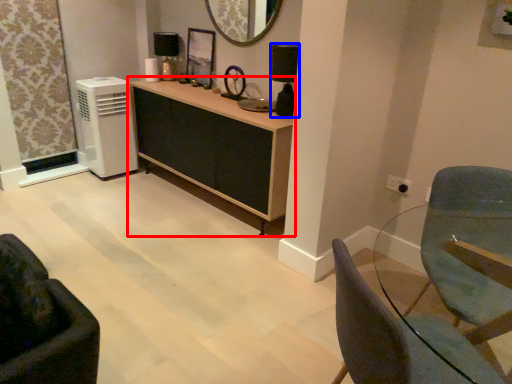
Question: Among these objects, which one is farthest to the camera, cabinetry (highlighted by a red box) or lamp (highlighted by a blue box)?

Choices:
 (A) cabinetry
 (B) lamp

Answer: (B)